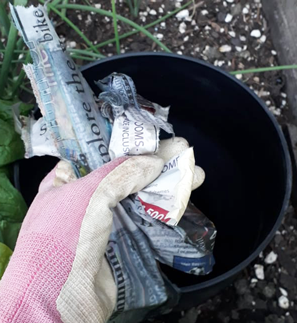
At what (x,y) coordinates should I click in order to perform the action: click on trash. Please return your answer as a coordinate pair (x, y). This screenshot has height=323, width=297. Looking at the image, I should click on (171, 197).